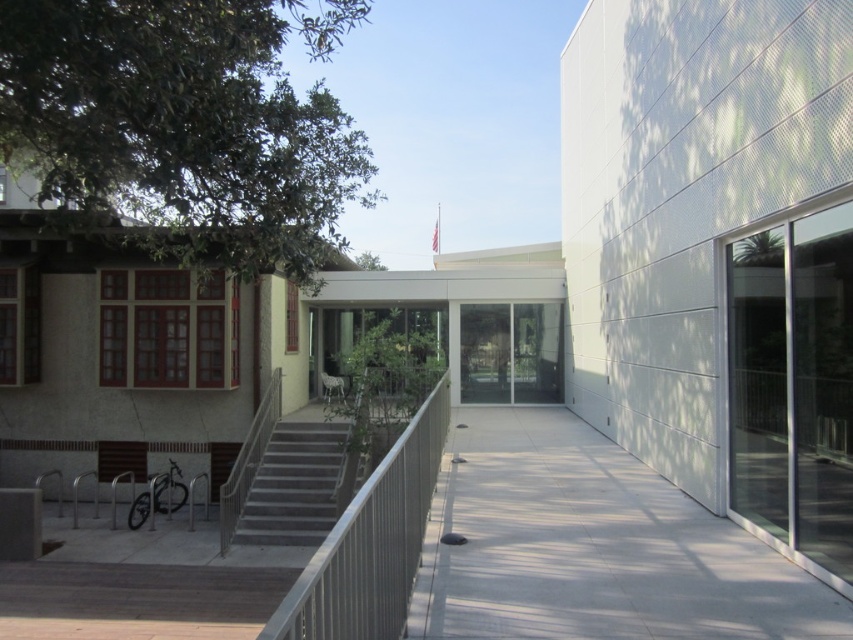
Is point (676, 572) less distant than point (413, 524)?

No, it is behind (413, 524).

Can you confirm if gray concrete pavement at center is thinner than metallic silver balustrade at center-left?

No.

What do you see at coordinates (592, 547) in the screenshot?
I see `gray concrete pavement at center` at bounding box center [592, 547].

Where is `gray concrete pavement at center`? gray concrete pavement at center is located at coordinates (592, 547).

The width and height of the screenshot is (853, 640). In order to click on metallic silver balustrade at center-left in this screenshot , I will do `click(370, 541)`.

Does metallic silver balustrade at center-left have a lesser width compared to gray concrete stairs at center?

Yes, metallic silver balustrade at center-left is thinner than gray concrete stairs at center.

Locate an element on the screen. Image resolution: width=853 pixels, height=640 pixels. metallic silver balustrade at center-left is located at coordinates (370, 541).

In the scene shown: Can you confirm if gray concrete pavement at center is taller than gray concrete stairs at center?

No.

Between point (793, 584) and point (329, 484), which one is positioned in front?

Point (793, 584) is more forward.

Is point (572, 442) more distant than point (335, 440)?

That is False.

Find the location of a particular element. gray concrete pavement at center is located at coordinates (592, 547).